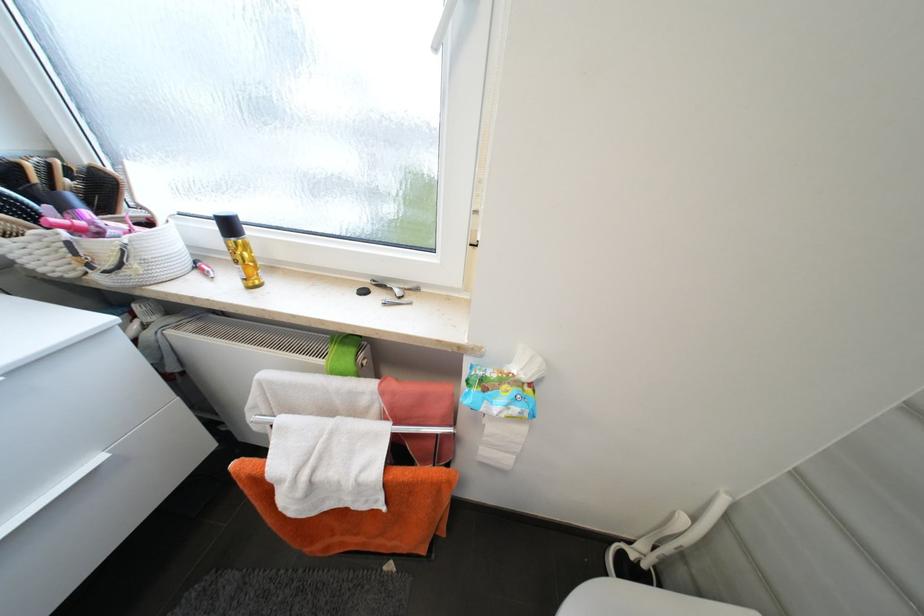
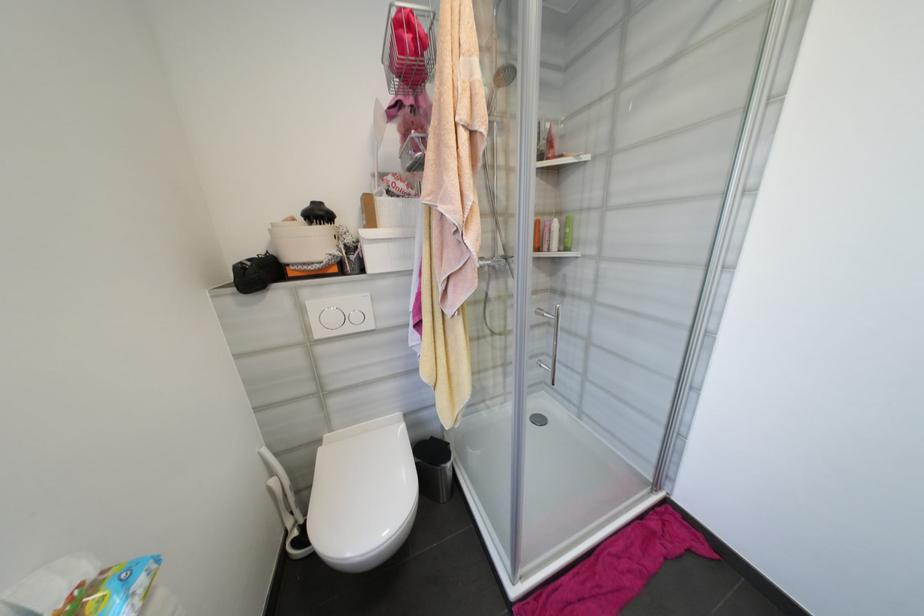
Locate, in the second image, the point that corresponds to (689,519) in the first image.

(277, 482)